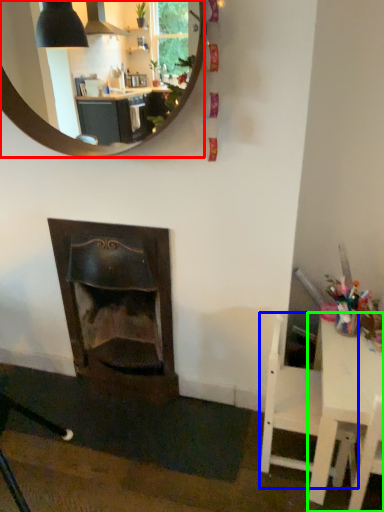
Question: Which object is the farthest from mirror (highlighted by a red box)? Choose among these: chair (highlighted by a blue box) or table (highlighted by a green box).

Choices:
 (A) chair
 (B) table

Answer: (B)